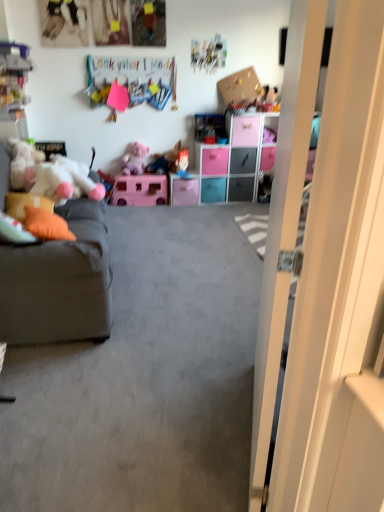
Identify the location of free point behind white glossy door at right. The height and width of the screenshot is (512, 384). point(210,359).